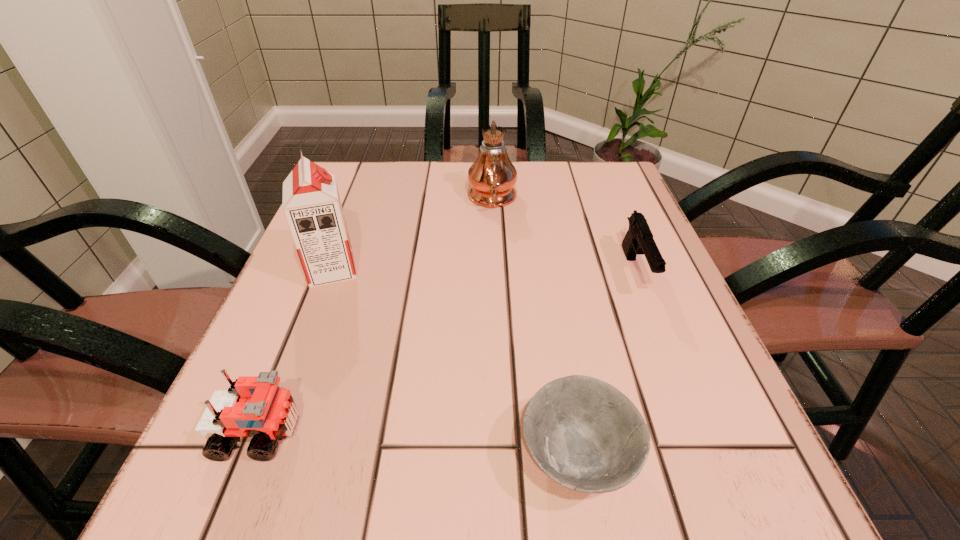
At what (x,y) coordinates should I click in order to perform the action: click on oil lamp. Please return your answer as a coordinate pair (x, y). Looking at the image, I should click on (492, 176).

Where is `the farthest object`? The width and height of the screenshot is (960, 540). the farthest object is located at coordinates (492, 176).

The image size is (960, 540). I want to click on the second tallest object, so click(312, 207).

You are a GUI agent. You are given a task and a screenshot of the screen. Output one action in this format:
    pyautogui.click(x=<x>, y=<y>)
    Task: Click on the Lego
    The height and width of the screenshot is (540, 960).
    Given the screenshot: What is the action you would take?
    pyautogui.click(x=255, y=406)

Locate an element on the screen. This screenshot has width=960, height=540. the rightmost object is located at coordinates [x=639, y=240].

In order to click on the shortest object in this screenshot , I will do `click(585, 434)`.

Identify the location of vacant space situated 0.150m on the left of the oil lamp. Image resolution: width=960 pixels, height=540 pixels. coord(403,199).

Locate an element on the screen. The width and height of the screenshot is (960, 540). free point located on the right of the soya milk is located at coordinates (563, 269).

This screenshot has height=540, width=960. Find the location of `free location located on the front-facing side of the Lego`. free location located on the front-facing side of the Lego is located at coordinates (512, 432).

Image resolution: width=960 pixels, height=540 pixels. Find the location of `vacant space positioned on the front-facing side of the rightmost object`. vacant space positioned on the front-facing side of the rightmost object is located at coordinates (709, 457).